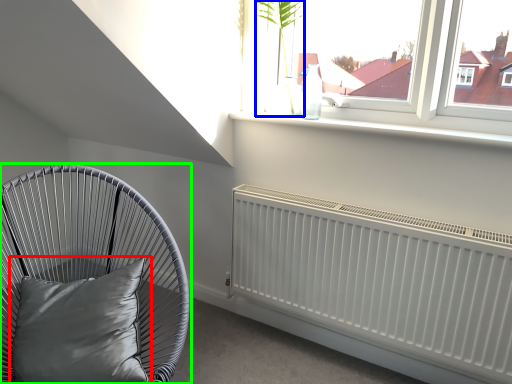
Question: Estimate the real-world distances between objects in this image. Which object is farther from pillow (highlighted by a red box), plant (highlighted by a blue box) or furniture (highlighted by a green box)?

Choices:
 (A) plant
 (B) furniture

Answer: (A)